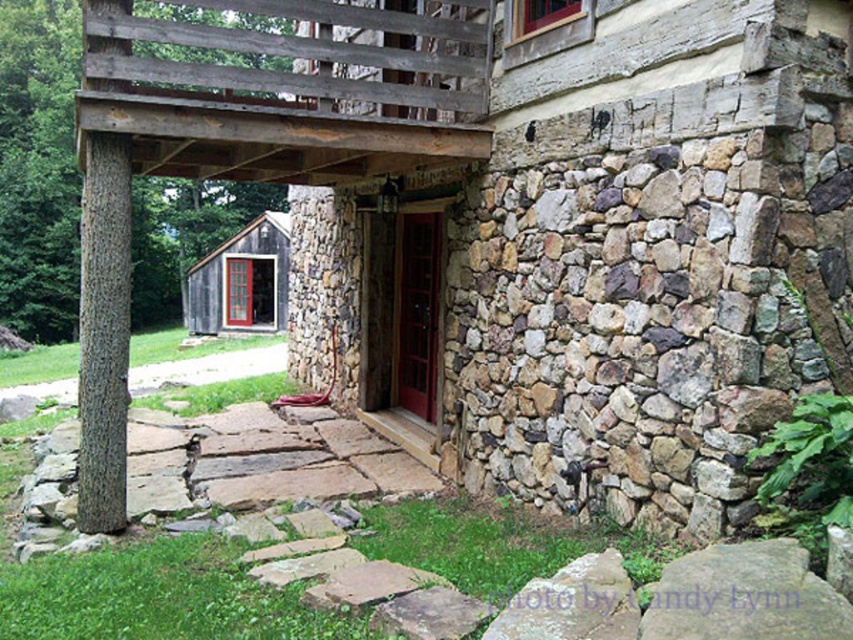
Can you confirm if brown rough bark tree at left is thinner than wooden cabin at lower left?

No.

Between point (57, 273) and point (189, 296), which one is positioned behind?

The point (189, 296) is more distant.

The width and height of the screenshot is (853, 640). I want to click on brown rough bark tree at left, so click(x=38, y=168).